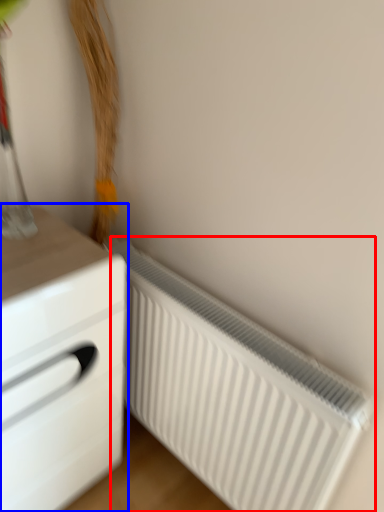
Question: Which point is further to the camera, radiator (highlighted by a red box) or chest of drawers (highlighted by a blue box)?

Choices:
 (A) radiator
 (B) chest of drawers

Answer: (A)